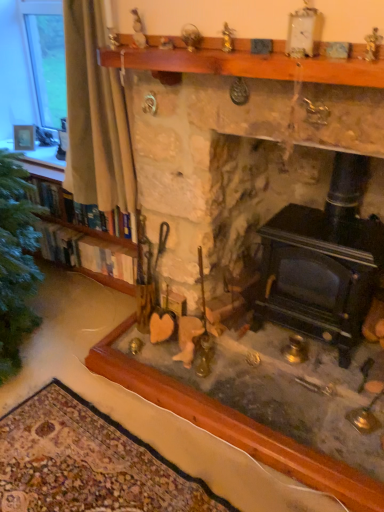
Where is `vacant space underneath white fabric curtain at left (from a real-world perspective)`? The width and height of the screenshot is (384, 512). vacant space underneath white fabric curtain at left (from a real-world perspective) is located at coordinates (100, 301).